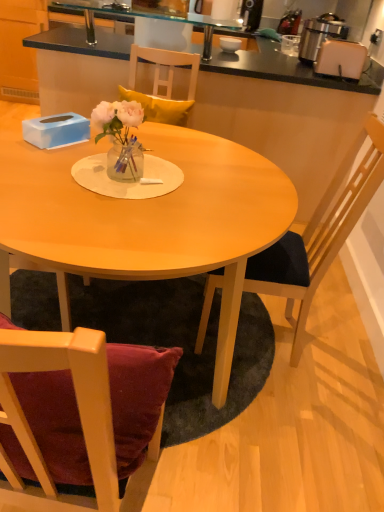
Question: Considering the relative sizes of metallic silver toaster at upper right and white plastic toaster at upper right in the image provided, is metallic silver toaster at upper right taller than white plastic toaster at upper right?

Choices:
 (A) no
 (B) yes

Answer: (B)

Question: Could you tell me if metallic silver toaster at upper right is turned towards white plastic toaster at upper right?

Choices:
 (A) no
 (B) yes

Answer: (A)

Question: Considering the relative sizes of metallic silver toaster at upper right and white plastic toaster at upper right in the image provided, is metallic silver toaster at upper right shorter than white plastic toaster at upper right?

Choices:
 (A) yes
 (B) no

Answer: (B)

Question: Does metallic silver toaster at upper right have a smaller size compared to white plastic toaster at upper right?

Choices:
 (A) no
 (B) yes

Answer: (A)

Question: Does metallic silver toaster at upper right have a lesser width compared to white plastic toaster at upper right?

Choices:
 (A) yes
 (B) no

Answer: (A)

Question: Is metallic silver toaster at upper right completely or partially outside of white plastic toaster at upper right?

Choices:
 (A) yes
 (B) no

Answer: (A)

Question: Considering the relative sizes of wooden chair at right and matte wood table at center in the image provided, is wooden chair at right taller than matte wood table at center?

Choices:
 (A) yes
 (B) no

Answer: (A)

Question: Are wooden chair at right and matte wood table at center beside each other?

Choices:
 (A) no
 (B) yes

Answer: (A)

Question: Can you confirm if wooden chair at right is shorter than matte wood table at center?

Choices:
 (A) no
 (B) yes

Answer: (A)

Question: Is wooden chair at right oriented away from matte wood table at center?

Choices:
 (A) yes
 (B) no

Answer: (A)

Question: Is wooden chair at right thinner than matte wood table at center?

Choices:
 (A) no
 (B) yes

Answer: (B)

Question: From the image's perspective, is wooden chair at right over matte wood table at center?

Choices:
 (A) no
 (B) yes

Answer: (B)

Question: From the image's perspective, is white glossy bowl at upper center located above black laminate cabinet at upper left?

Choices:
 (A) yes
 (B) no

Answer: (B)